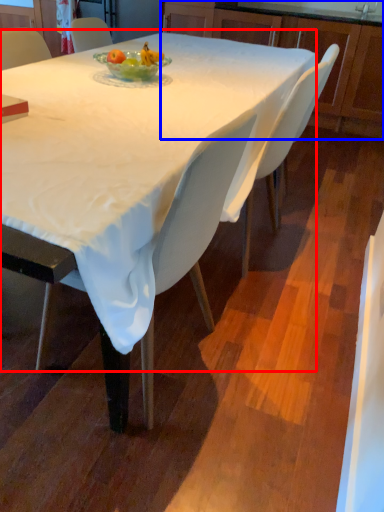
Question: Among these objects, which one is nearest to the camera, round table (highlighted by a red box) or cabinetry (highlighted by a blue box)?

Choices:
 (A) round table
 (B) cabinetry

Answer: (A)